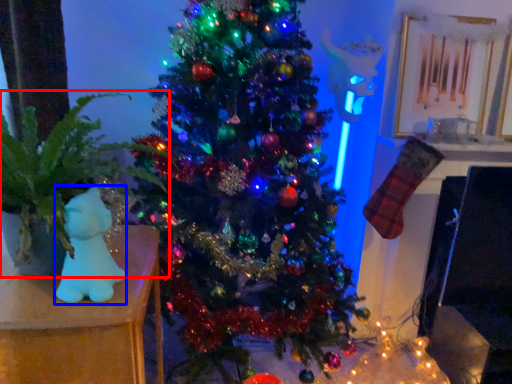
Question: Which object is closer to the camera taking this photo, houseplant (highlighted by a red box) or toy (highlighted by a blue box)?

Choices:
 (A) houseplant
 (B) toy

Answer: (A)